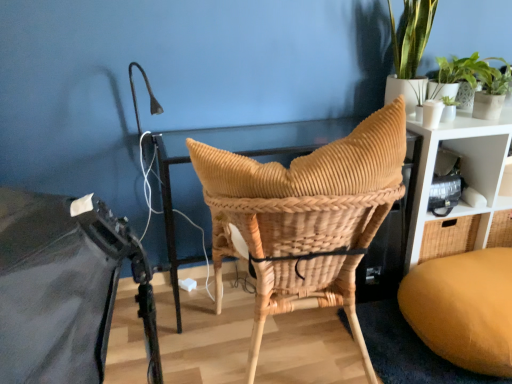
You are a GUI agent. You are given a task and a screenshot of the screen. Output one action in this format:
    pyautogui.click(x=<x>, y=<y>)
    Task: Click on the free spot below natural woven chair at center (from a real-world perspective)
    The width and height of the screenshot is (512, 384).
    Given the screenshot: What is the action you would take?
    pyautogui.click(x=291, y=343)